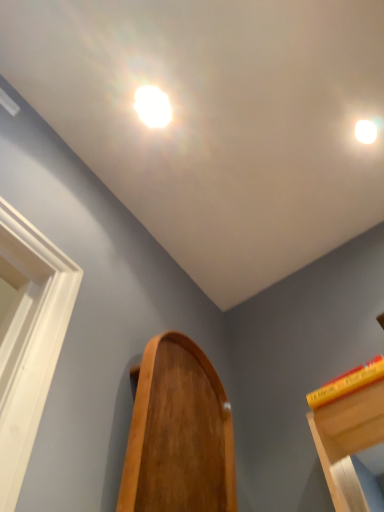
Question: In terms of width, does wooden mirror at center look wider or thinner when compared to white glossy droplight at upper right, the 1th droplight in the right-to-left sequence?

Choices:
 (A) wide
 (B) thin

Answer: (A)

Question: Is point (158, 495) closer or farther from the camera than point (360, 119)?

Choices:
 (A) farther
 (B) closer

Answer: (B)

Question: Which object is the closest to the yellow matte book at upper right?

Choices:
 (A) wooden mirror at center
 (B) white glossy droplight at upper center, which is the second droplight from right to left
 (C) white glossy droplight at upper right, marked as the second droplight in a left-to-right arrangement

Answer: (A)

Question: Which object is positioned farthest from the white glossy droplight at upper right, marked as the second droplight in a left-to-right arrangement?

Choices:
 (A) yellow matte book at upper right
 (B) white glossy droplight at upper center, which is the second droplight from right to left
 (C) wooden mirror at center

Answer: (C)